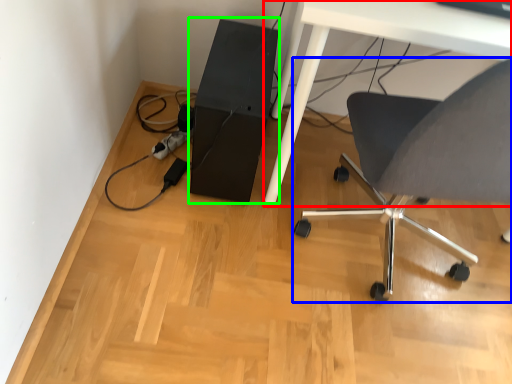
Question: Considering the real-world distances, which object is farthest from table (highlighted by a red box)? chair (highlighted by a blue box) or computer tower (highlighted by a green box)?

Choices:
 (A) chair
 (B) computer tower

Answer: (A)